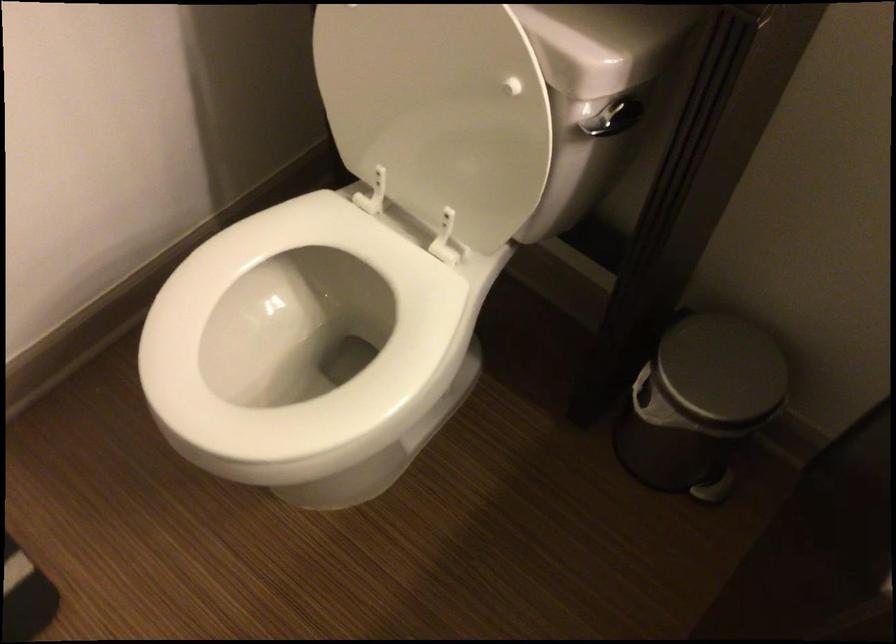
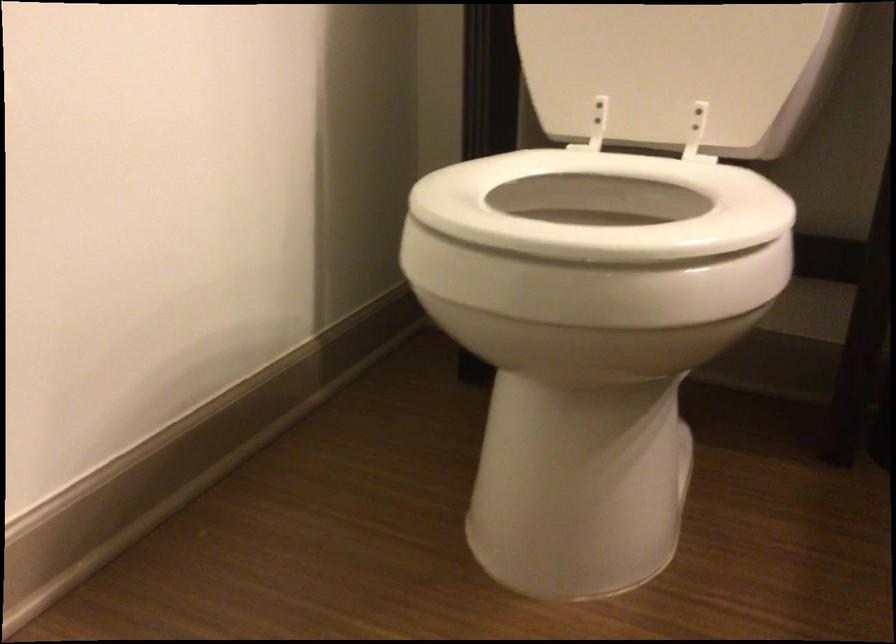
Where in the second image is the point corresponding to [368,254] from the first image?

(602, 205)